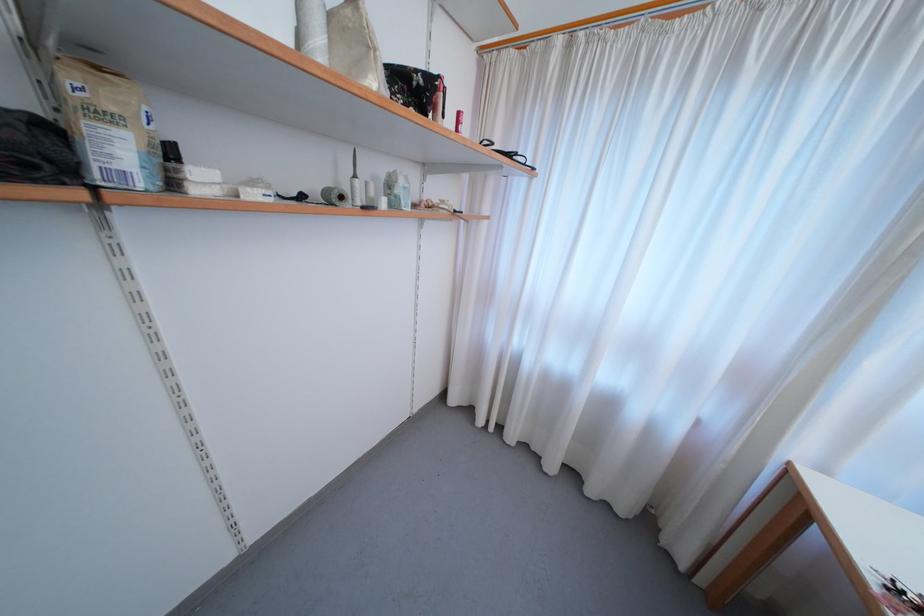
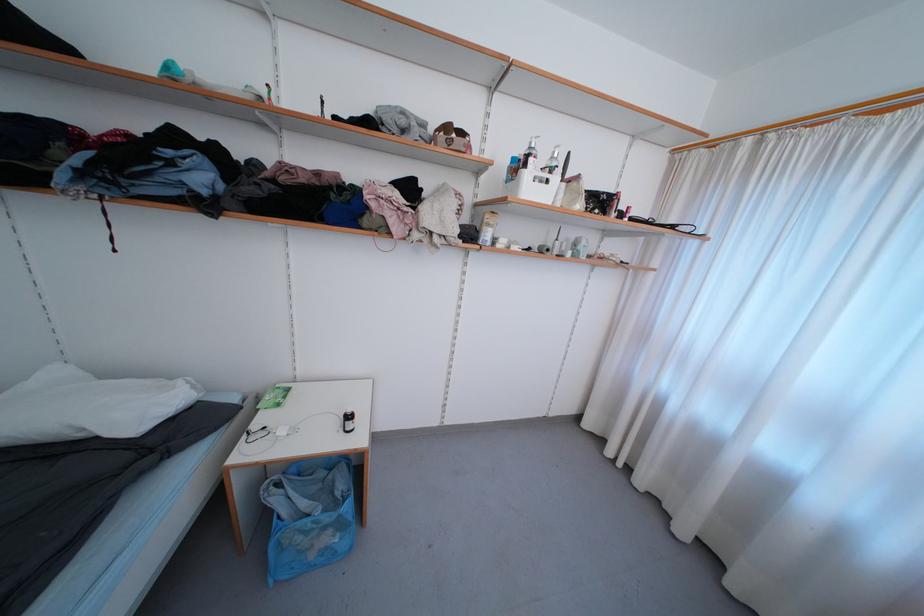
The point at (381, 84) is marked in the first image. Where is the corresponding point in the second image?

(584, 208)